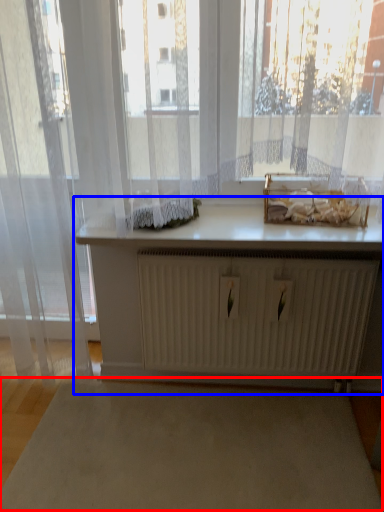
Question: Which object appears farthest to the camera in this image, plain (highlighted by a red box) or table (highlighted by a blue box)?

Choices:
 (A) plain
 (B) table

Answer: (B)